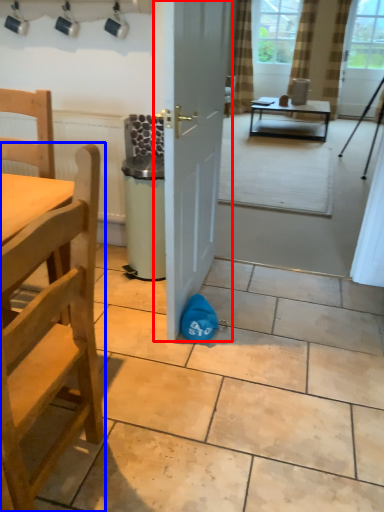
Question: Which object appears closest to the camera in this image, door (highlighted by a red box) or chair (highlighted by a blue box)?

Choices:
 (A) door
 (B) chair

Answer: (B)